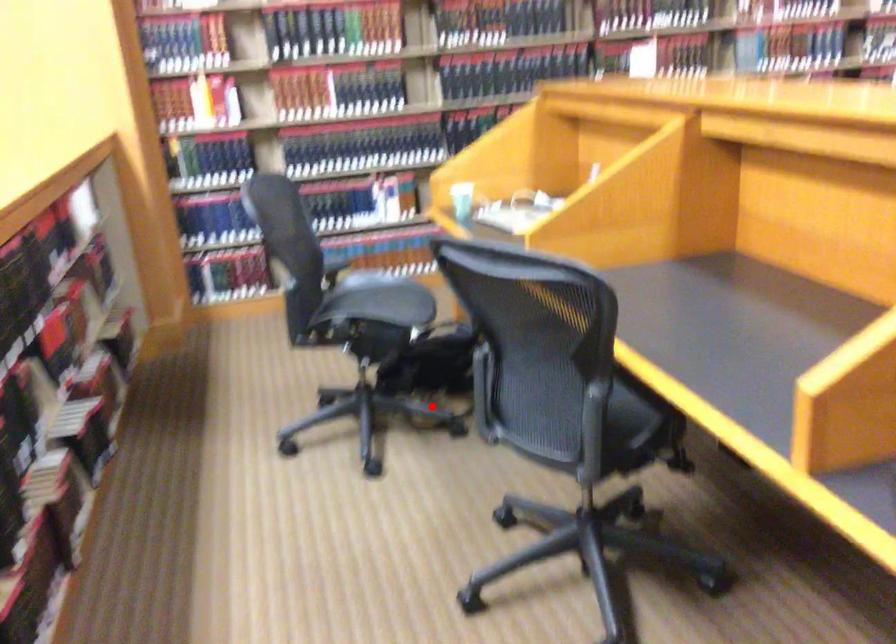
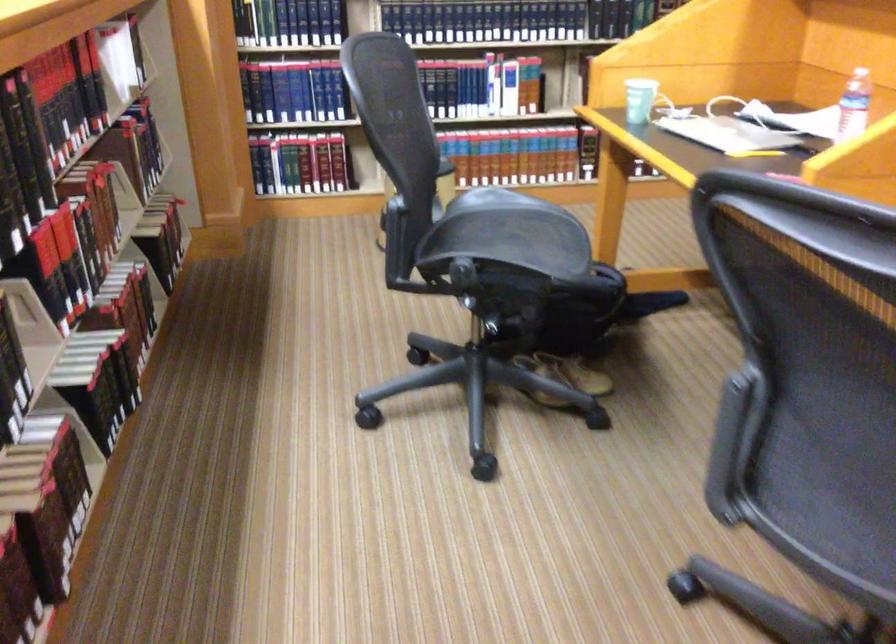
Question: I am providing you with two images of the same scene from different viewpoints. A red point is shown in image1. For the corresponding object point in image2, is it positioned nearer or farther from the camera?

Choices:
 (A) Nearer
 (B) Farther

Answer: (A)